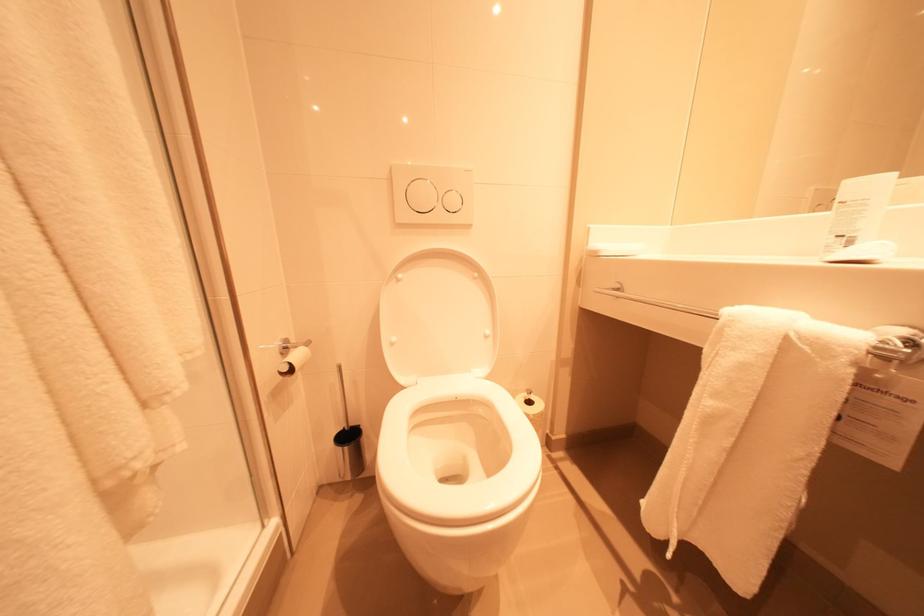
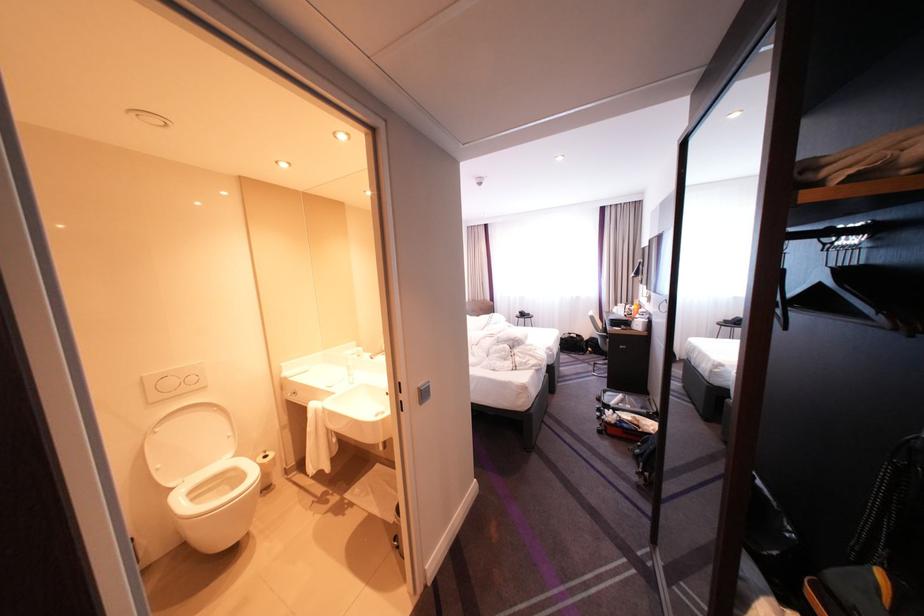
In the second image, find the point that corresponds to (x=403, y=180) in the first image.

(154, 384)